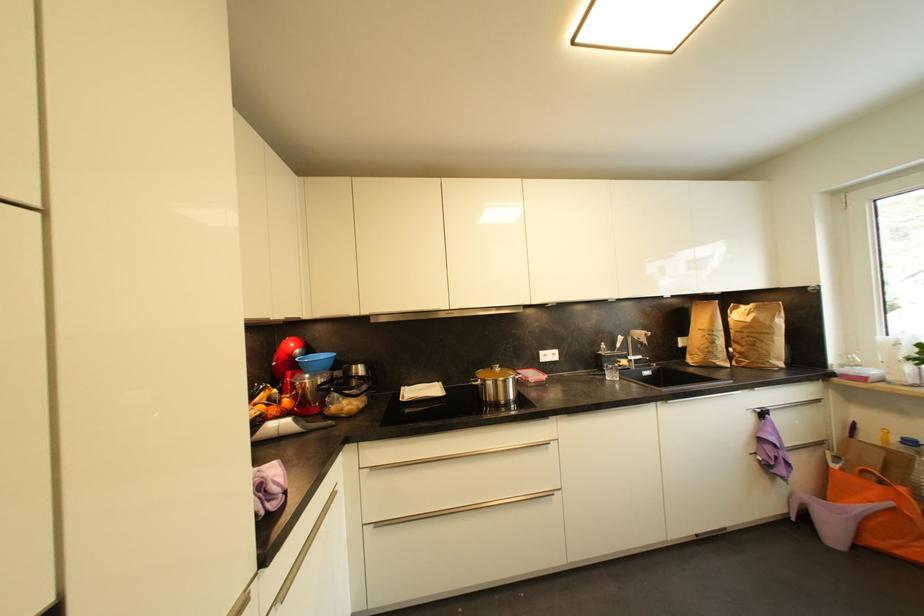
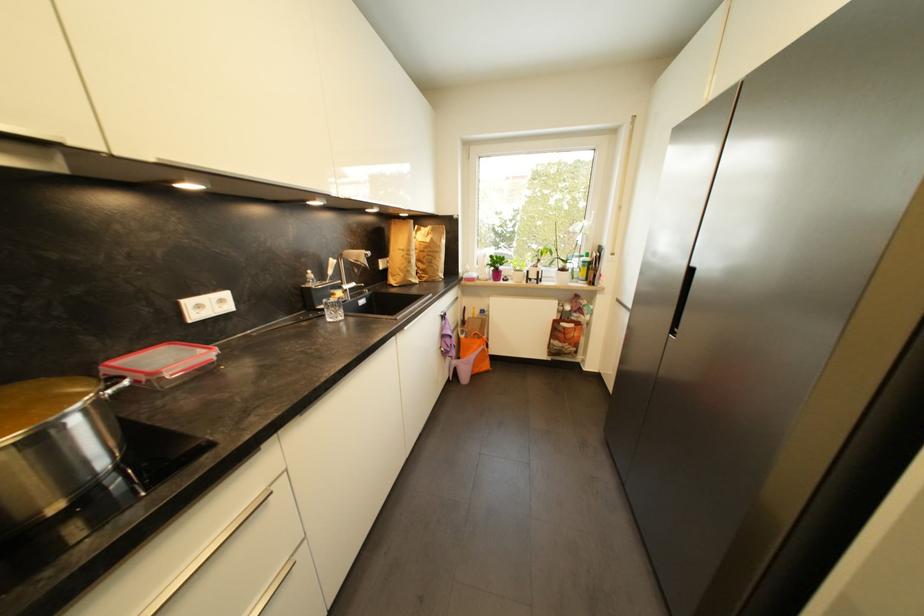
Where in the second image is the point corresponding to [616,378] from the first image?

(339, 317)